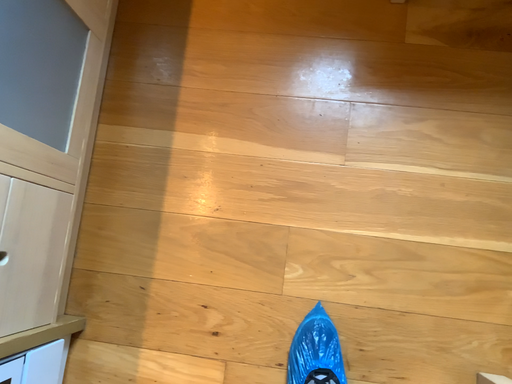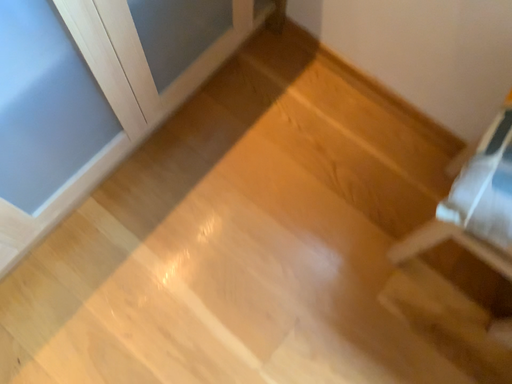
Question: How did the camera likely rotate when shooting the video?

Choices:
 (A) rotated downward
 (B) rotated upward

Answer: (B)